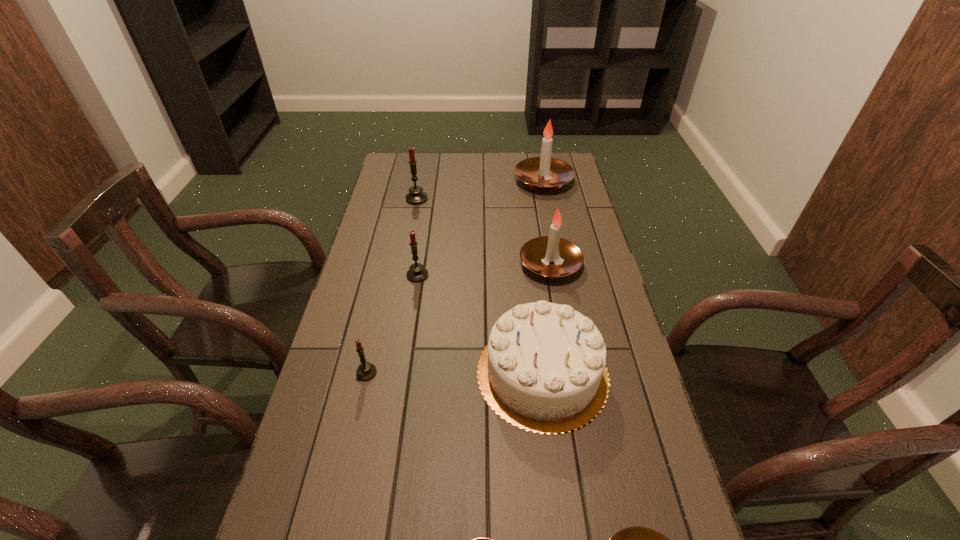
Where is `the farthest white candle`? Image resolution: width=960 pixels, height=540 pixels. the farthest white candle is located at coordinates (544, 173).

At what (x,y) coordinates should I click in order to perform the action: click on the tallest object. Please return your answer as a coordinate pair (x, y). The height and width of the screenshot is (540, 960). Looking at the image, I should click on (544, 173).

This screenshot has width=960, height=540. What are the coordinates of `the biggest red candle` in the screenshot? It's located at coord(416,196).

Locate an element on the screen. This screenshot has width=960, height=540. the second farthest white candle is located at coordinates (552, 257).

Identify the location of birthday cake. (543, 370).

Identify the location of the second nearest red candle. (417, 273).

Image resolution: width=960 pixels, height=540 pixels. I want to click on the nearest red candle, so click(x=366, y=371).

Identify the location of the fifth farthest candle. (366, 371).

Find the location of a particular element. This screenshot has height=540, width=960. free region located 0.170m on the front of the farthest white candle is located at coordinates (551, 222).

Identify the location of free space located on the front of the farthest red candle. Image resolution: width=960 pixels, height=540 pixels. (404, 266).